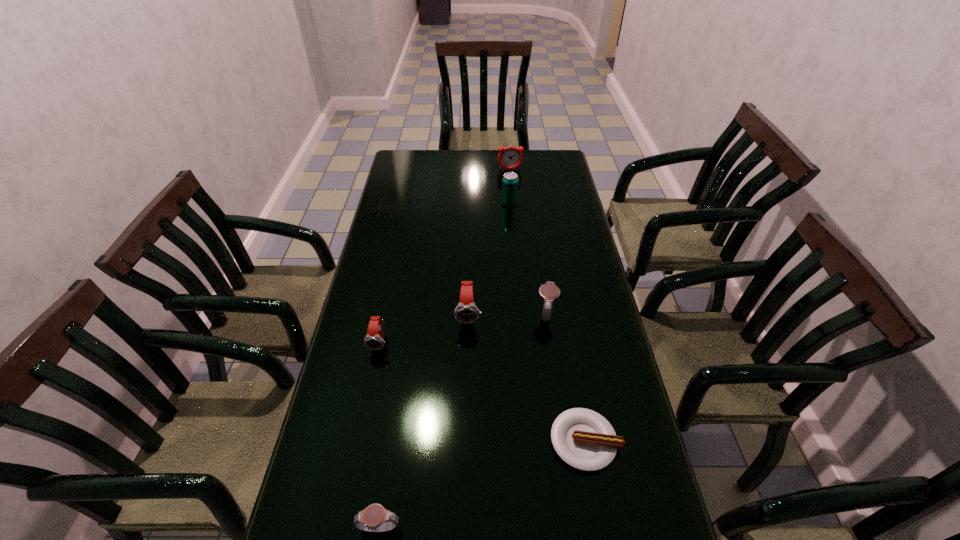
Locate an element on the screen. This screenshot has height=540, width=960. the sixth farthest object is located at coordinates (584, 439).

Where is `sausage`? sausage is located at coordinates (584, 439).

Find the location of `free location located 0.210m on the left of the sixth nearest object`. free location located 0.210m on the left of the sixth nearest object is located at coordinates (449, 203).

Identify the location of free location located on the face of the third watch from left to right. (466, 427).

Locate an element on the screen. This screenshot has width=960, height=540. free region located 0.400m on the front-facing side of the reddish-pink alarm clock is located at coordinates (516, 225).

Locate an element on the screen. This screenshot has width=960, height=540. free spot located 0.310m on the back of the rightmost watch is located at coordinates (535, 239).

Locate an element on the screen. This screenshot has width=960, height=540. vacant region located on the face of the smaller red watch is located at coordinates (372, 382).

The width and height of the screenshot is (960, 540). What are the coordinates of `free spot located 0.130m on the left of the sausage` in the screenshot? It's located at (497, 441).

Locate an element on the screen. The image size is (960, 540). object that is at the far edge is located at coordinates (510, 157).

Find the location of `object that is positioned at the left edge`. object that is positioned at the left edge is located at coordinates (374, 340).